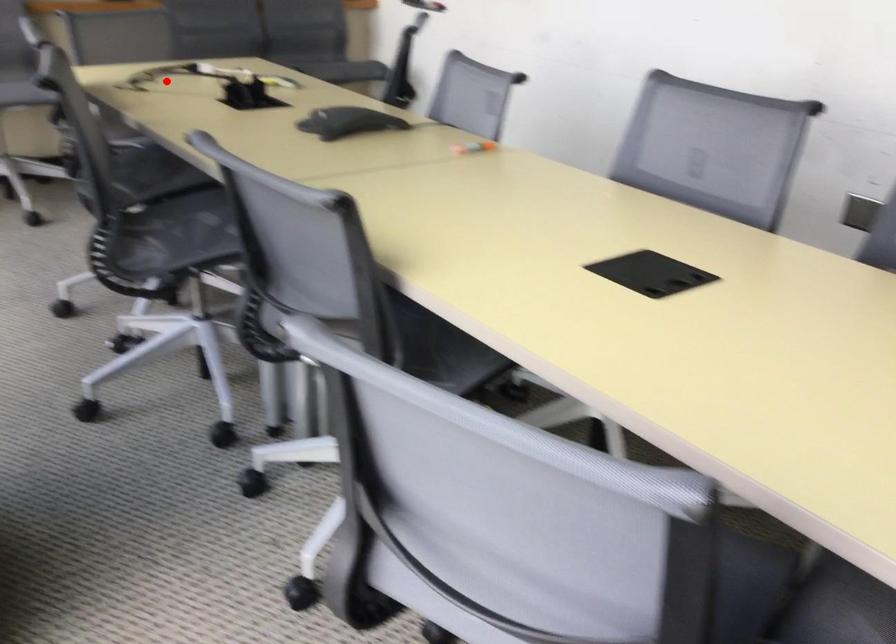
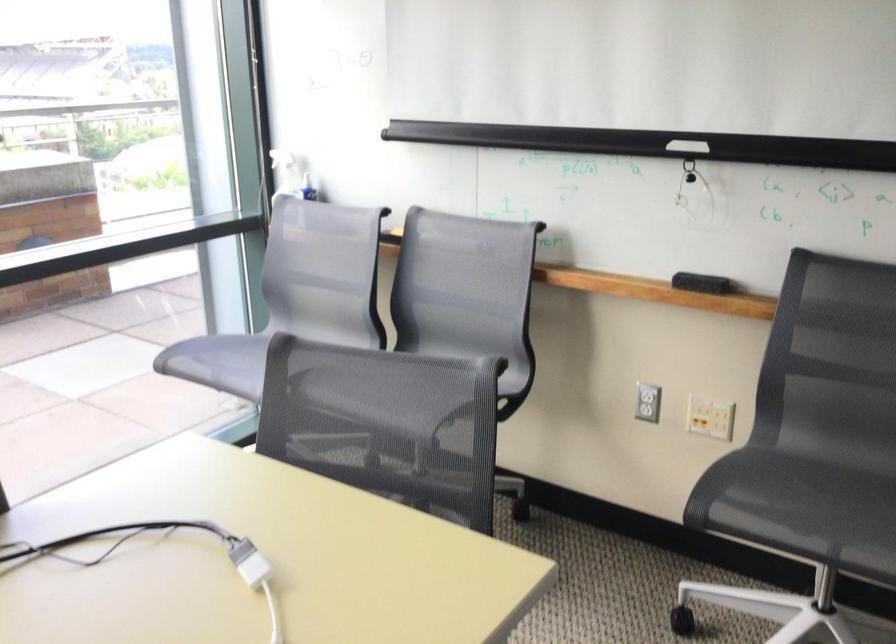
In the second image, find the point that corresponds to the highlighted location in the first image.

(161, 554)